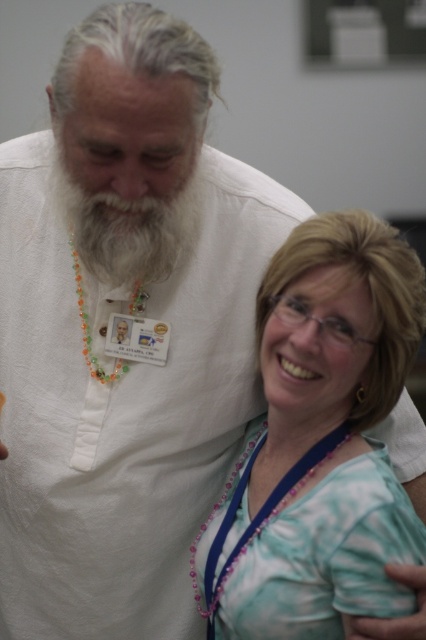
Which is below, teal fabric shirt at lower right or white soft beard at center?

teal fabric shirt at lower right is below.

Which is more to the left, teal fabric shirt at lower right or white soft beard at center?

From the viewer's perspective, white soft beard at center appears more on the left side.

Identify the location of teal fabric shirt at lower right. (321, 442).